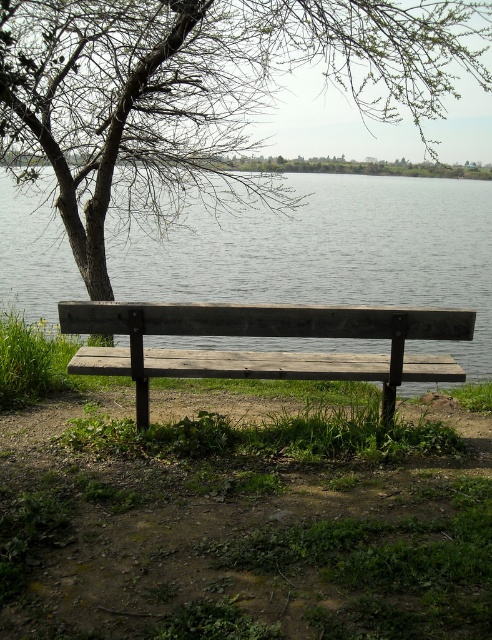
You are standing at the center of the image and want to walk towards the brown wood tree at upper left. In which direction should you move?

You should move towards the upper left direction to reach the brown wood tree at upper left since it is located at point (200, 92).

You are planning to take a photo of the brown wood tree at upper left and the gray water at bench right from the lakeside. Which object will appear narrower in your photo?

The brown wood tree at upper left will appear narrower in the photo because it has a lesser width compared to the gray water at bench right.